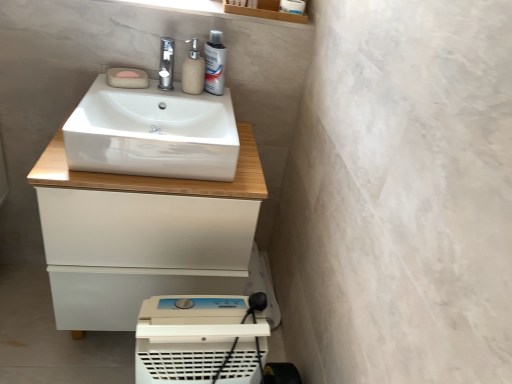
Question: Considering the relative sizes of satin nickel faucet at upper center and white glossy sink at center in the image provided, is satin nickel faucet at upper center bigger than white glossy sink at center?

Choices:
 (A) no
 (B) yes

Answer: (A)

Question: From a real-world perspective, is satin nickel faucet at upper center below white glossy sink at center?

Choices:
 (A) no
 (B) yes

Answer: (A)

Question: Is white glossy sink at center a part of satin nickel faucet at upper center?

Choices:
 (A) no
 (B) yes

Answer: (A)

Question: From the image's perspective, is satin nickel faucet at upper center under white glossy sink at center?

Choices:
 (A) no
 (B) yes

Answer: (A)

Question: Is satin nickel faucet at upper center further to camera compared to white glossy sink at center?

Choices:
 (A) yes
 (B) no

Answer: (A)

Question: Is point (82, 104) positioned closer to the camera than point (168, 59)?

Choices:
 (A) closer
 (B) farther

Answer: (A)

Question: From their relative heights in the image, would you say white glossy sink at center is taller or shorter than satin nickel faucet at upper center?

Choices:
 (A) tall
 (B) short

Answer: (A)

Question: Is white glossy sink at center spatially inside satin nickel faucet at upper center, or outside of it?

Choices:
 (A) outside
 (B) inside

Answer: (A)

Question: From a real-world perspective, is white glossy sink at center above or below satin nickel faucet at upper center?

Choices:
 (A) below
 (B) above

Answer: (A)

Question: Considering the positions of white glossy sink at center and pink felt soap at upper left, which is the 2th soap in top-to-bottom order, in the image, is white glossy sink at center bigger or smaller than pink felt soap at upper left, which is the 2th soap in top-to-bottom order,?

Choices:
 (A) big
 (B) small

Answer: (A)

Question: Is point (181, 160) closer or farther from the camera than point (118, 84)?

Choices:
 (A) closer
 (B) farther

Answer: (A)

Question: Is white glossy sink at center situated inside pink felt soap at upper left, which is the 2th soap in top-to-bottom order, or outside?

Choices:
 (A) inside
 (B) outside

Answer: (B)

Question: Looking at their shapes, would you say white glossy sink at center is wider or thinner than pink felt soap at upper left, the first soap in the bottom-to-top sequence?

Choices:
 (A) thin
 (B) wide

Answer: (B)

Question: From the image's perspective, is white glossy sink at center positioned above or below silver metallic mouthwash at upper center?

Choices:
 (A) above
 (B) below

Answer: (B)

Question: Which is correct: white glossy sink at center is inside silver metallic mouthwash at upper center, or outside of it?

Choices:
 (A) inside
 (B) outside

Answer: (B)